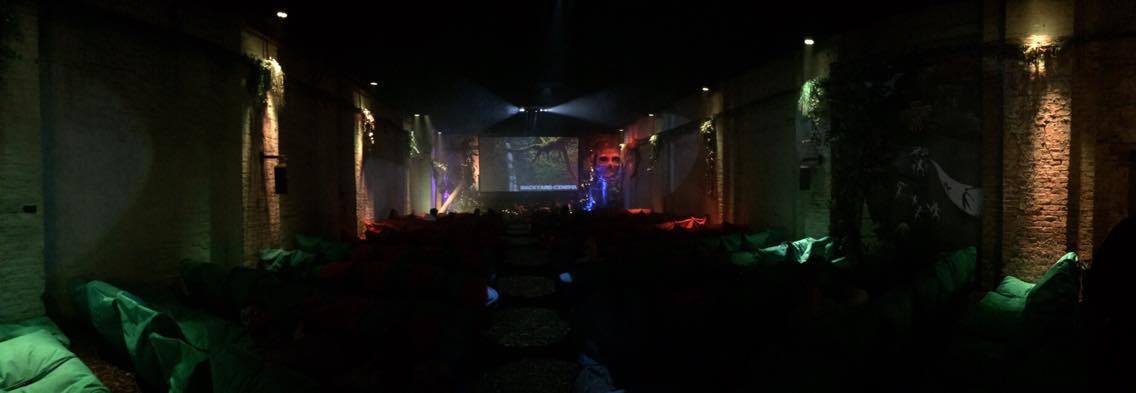
Where is `orange light`? This screenshot has width=1136, height=393. orange light is located at coordinates (1005, 47).